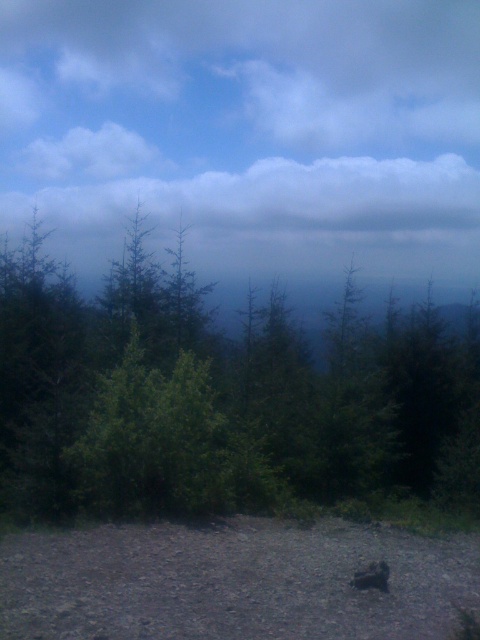
You are standing in a forest and see the green matte forest at center and the brown furry dog at lower center. Which object is closer to you?

The brown furry dog at lower center is closer to you because the green matte forest at center is further away.

You are standing in the middle of the forest and want to take a photo of the brown furry dog at lower center without the green matte forest at center blocking the view. Is this possible?

The green matte forest at center is much taller than the brown furry dog at lower center. Therefore, the forest would block the view of the dog, making it impossible to take a clear photo without obstruction.